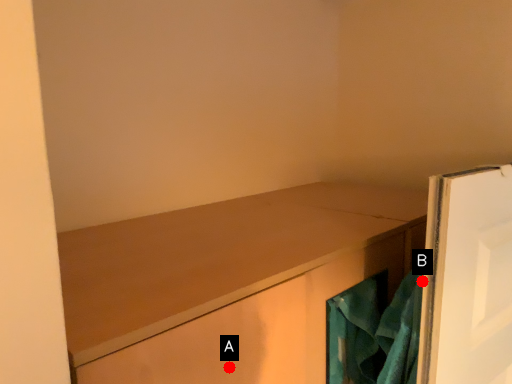
Question: Two points are circled on the image, labeled by A and B beside each circle. Which point is closer to the camera?

Choices:
 (A) A is closer
 (B) B is closer

Answer: (A)